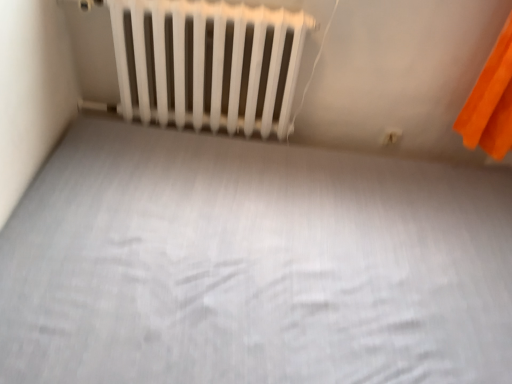
Question: Is white matte bed frame at center aimed at white plastic electric outlet at upper right?

Choices:
 (A) yes
 (B) no

Answer: (B)

Question: Does white matte bed frame at center have a lesser width compared to white plastic electric outlet at upper right?

Choices:
 (A) no
 (B) yes

Answer: (A)

Question: Can you confirm if white matte bed frame at center is wider than white plastic electric outlet at upper right?

Choices:
 (A) no
 (B) yes

Answer: (B)

Question: From the image's perspective, is white matte bed frame at center located beneath white plastic electric outlet at upper right?

Choices:
 (A) yes
 (B) no

Answer: (A)

Question: Is white matte bed frame at center at the left side of white plastic electric outlet at upper right?

Choices:
 (A) no
 (B) yes

Answer: (B)

Question: Does white matte bed frame at center contain white plastic electric outlet at upper right?

Choices:
 (A) no
 (B) yes

Answer: (A)

Question: From the image's perspective, is white matte radiator at upper center over white matte bed frame at center?

Choices:
 (A) yes
 (B) no

Answer: (A)

Question: From the image's perspective, would you say white matte radiator at upper center is shown under white matte bed frame at center?

Choices:
 (A) yes
 (B) no

Answer: (B)

Question: Considering the relative sizes of white matte radiator at upper center and white matte bed frame at center in the image provided, is white matte radiator at upper center shorter than white matte bed frame at center?

Choices:
 (A) yes
 (B) no

Answer: (B)

Question: Is white matte radiator at upper center next to white matte bed frame at center?

Choices:
 (A) no
 (B) yes

Answer: (A)

Question: Can you confirm if white matte radiator at upper center is wider than white matte bed frame at center?

Choices:
 (A) yes
 (B) no

Answer: (B)

Question: Does white matte radiator at upper center turn towards white matte bed frame at center?

Choices:
 (A) yes
 (B) no

Answer: (A)

Question: Is white plastic electric outlet at upper right facing away from white matte bed frame at center?

Choices:
 (A) yes
 (B) no

Answer: (B)